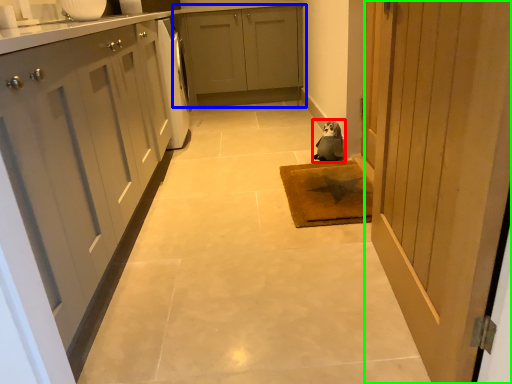
Question: Considering the real-world distances, which object is closest to animal (highlighted by a red box)? cabinetry (highlighted by a blue box) or door (highlighted by a green box).

Choices:
 (A) cabinetry
 (B) door

Answer: (B)